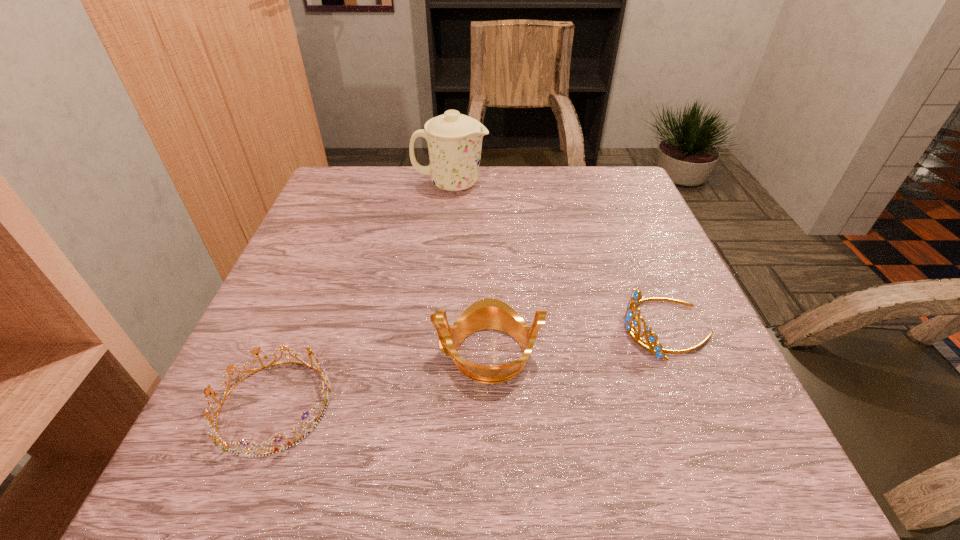
The height and width of the screenshot is (540, 960). In order to click on chinaware in this screenshot , I will do `click(454, 140)`.

Where is `the tallest object`? Image resolution: width=960 pixels, height=540 pixels. the tallest object is located at coordinates (454, 140).

Locate an element on the screen. the second tiara from left to right is located at coordinates (489, 313).

Locate an element on the screen. the rightmost object is located at coordinates (631, 322).

Locate an element on the screen. Image resolution: width=960 pixels, height=540 pixels. the leftmost tiara is located at coordinates (218, 441).

Image resolution: width=960 pixels, height=540 pixels. I want to click on the leftmost object, so click(218, 441).

The height and width of the screenshot is (540, 960). Identify the location of vacant space positioned 0.120m on the spout of the chinaware. (532, 185).

The width and height of the screenshot is (960, 540). I want to click on vacant region located 0.260m at the front emblem of the second tiara from left to right, so click(286, 353).

Locate an element on the screen. Image resolution: width=960 pixels, height=540 pixels. blank space located at the front emblem of the second tiara from left to right is located at coordinates (326, 353).

Where is `vacant space located 0.140m at the front emblem of the second tiara from left to right`? The image size is (960, 540). vacant space located 0.140m at the front emblem of the second tiara from left to right is located at coordinates (354, 353).